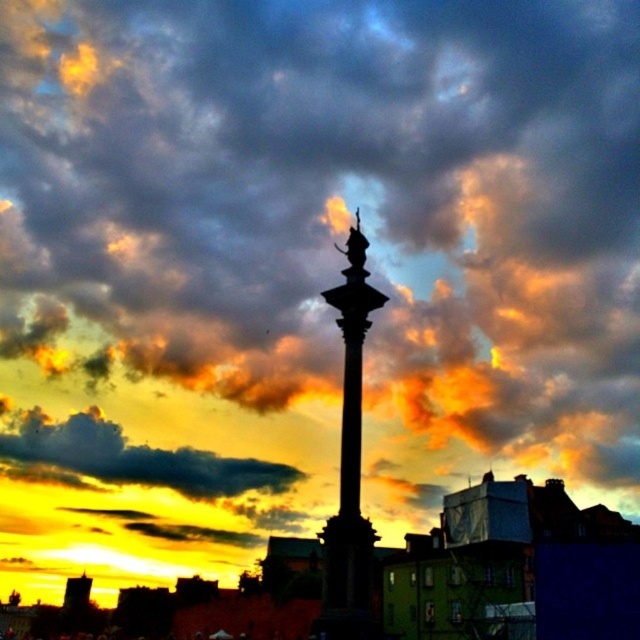
Does polished stone column at center appear on the left side of cloudy sky at upper center?

In fact, polished stone column at center is to the right of cloudy sky at upper center.

Can you confirm if polished stone column at center is positioned below cloudy sky at upper center?

Actually, polished stone column at center is above cloudy sky at upper center.

Is point (346, 632) closer to viewer compared to point (268, 474)?

That is True.

I want to click on polished stone column at center, so click(349, 467).